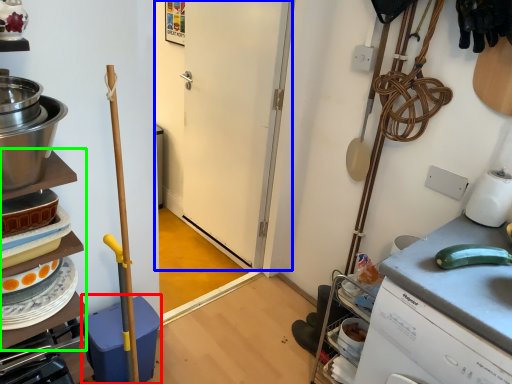
Question: Which object is the closest to the dish washer (highlighted by a red box)? Choose among these: door (highlighted by a blue box) or shelf (highlighted by a green box).

Choices:
 (A) door
 (B) shelf

Answer: (B)